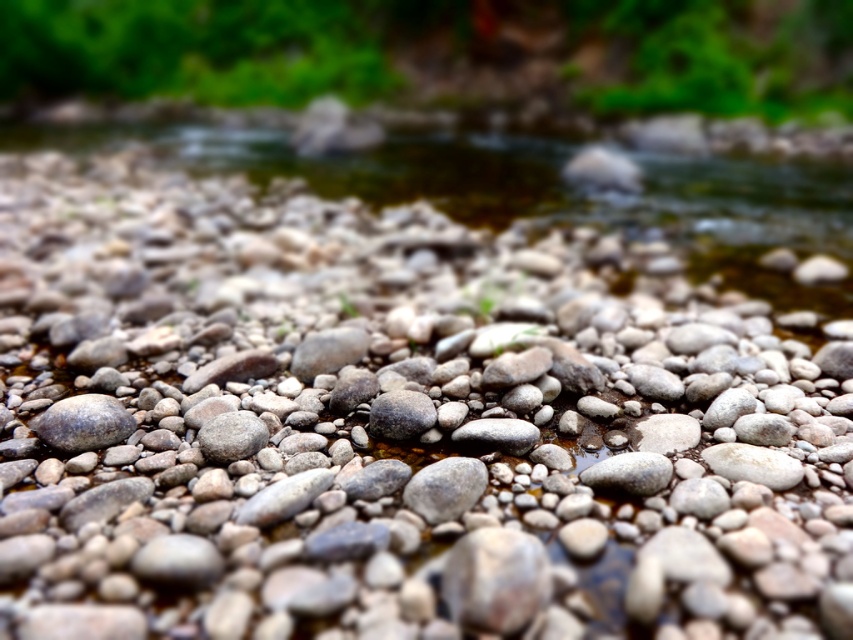
Question: Can you confirm if smooth gray rock at center is positioned to the left of gray matte rock at center?

Choices:
 (A) no
 (B) yes

Answer: (B)

Question: Which object is the closest to the smooth gray stone at center?

Choices:
 (A) smooth gray rock at lower left
 (B) smooth gray rock at center

Answer: (B)

Question: Does smooth gray rock at center have a greater width compared to gray matte rock at center?

Choices:
 (A) no
 (B) yes

Answer: (A)

Question: Does smooth gray rock at center appear on the right side of gray matte rock at center?

Choices:
 (A) no
 (B) yes

Answer: (A)

Question: Which object is closer to the camera taking this photo?

Choices:
 (A) gray matte rock at center
 (B) smooth gray rock at lower left

Answer: (B)

Question: Based on their relative distances, which object is farther from the smooth gray stone at center?

Choices:
 (A) gray matte rock at center
 (B) smooth gray rock at lower left

Answer: (B)